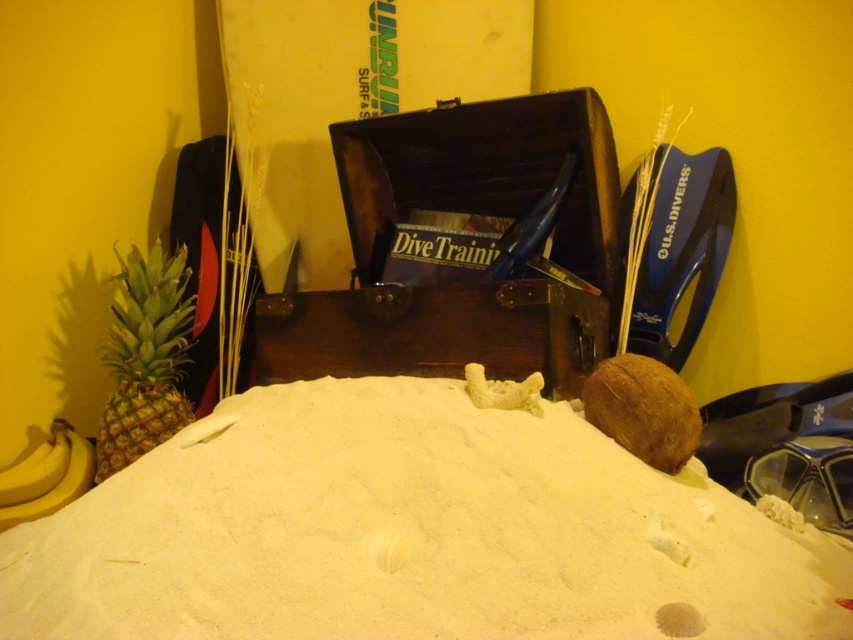
Question: From the image, what is the correct spatial relationship of white sand at center in relation to green textured pineapple at left?

Choices:
 (A) above
 (B) below

Answer: (B)

Question: Which is farther from the yellow matte bananas at lower left?

Choices:
 (A) wooden chest at center
 (B) white sand at center
 (C) green textured pineapple at left

Answer: (A)

Question: Among these objects, which one is nearest to the camera?

Choices:
 (A) white sand at center
 (B) green textured pineapple at left
 (C) wooden chest at center
 (D) yellow matte bananas at lower left

Answer: (A)

Question: Is white sand at center below green textured pineapple at left?

Choices:
 (A) no
 (B) yes

Answer: (B)

Question: Which point appears farthest from the camera in this image?

Choices:
 (A) (282, 525)
 (B) (405, 145)
 (C) (22, 486)

Answer: (B)

Question: From the image, what is the correct spatial relationship of white sand at center in relation to wooden chest at center?

Choices:
 (A) above
 (B) below

Answer: (B)